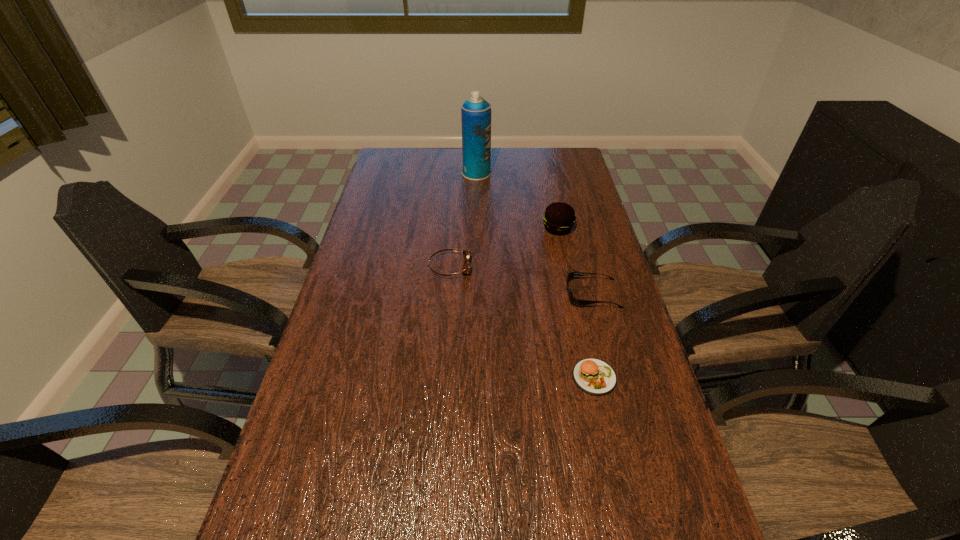
Where is `the tallest object`? This screenshot has height=540, width=960. the tallest object is located at coordinates (475, 112).

I want to click on aerosol can, so click(x=475, y=112).

I want to click on the taller patty, so click(559, 218).

Locate an element on the screen. The image size is (960, 540). the fourth shortest object is located at coordinates (559, 218).

Where is `goggles`? The height and width of the screenshot is (540, 960). goggles is located at coordinates (466, 254).

The image size is (960, 540). Find the location of `the shorter patty`. the shorter patty is located at coordinates pyautogui.click(x=593, y=376).

What are the coordinates of `the nearer patty` in the screenshot? It's located at (593, 376).

What are the coordinates of `sunglasses` in the screenshot? It's located at (576, 302).

Identify the location of blank space located 0.320m on the front of the farthest object. (475, 231).

Identify the location of free location located 0.200m on the front of the fourth nearest object. Image resolution: width=960 pixels, height=540 pixels. (568, 280).